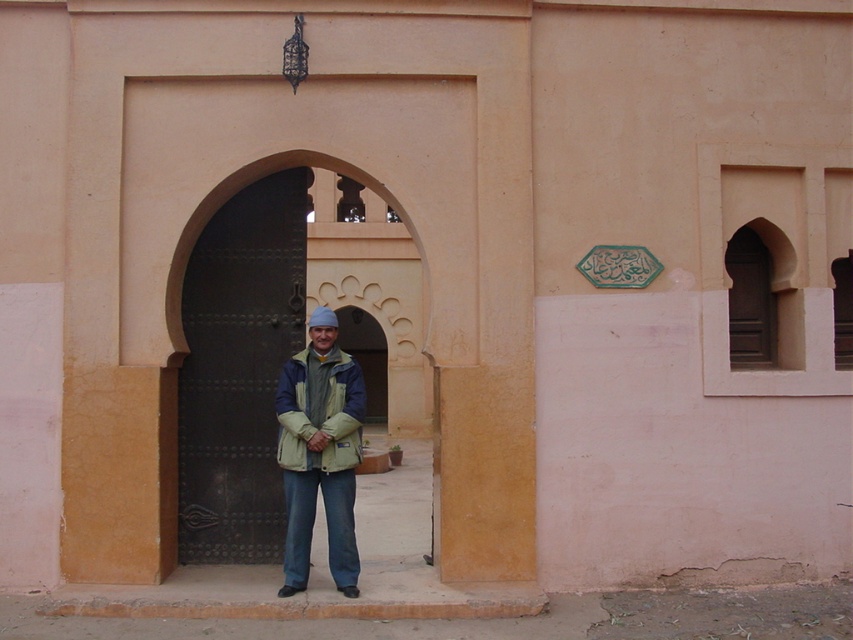
Does dark brown metal door at center appear under light green fabric jacket at center?

Actually, dark brown metal door at center is above light green fabric jacket at center.

Is dark brown metal door at center bigger than light green fabric jacket at center?

Correct, dark brown metal door at center is larger in size than light green fabric jacket at center.

What are the coordinates of `dark brown metal door at center` in the screenshot? It's located at (239, 371).

The height and width of the screenshot is (640, 853). In order to click on dark brown metal door at center in this screenshot , I will do `click(239, 371)`.

Measure the distance from dark brown metal door at center to beige textured jacket at center.

23.43 inches

Can you confirm if dark brown metal door at center is positioned to the right of beige textured jacket at center?

Incorrect, dark brown metal door at center is not on the right side of beige textured jacket at center.

You are a GUI agent. You are given a task and a screenshot of the screen. Output one action in this format:
    pyautogui.click(x=<x>, y=<y>)
    Task: Click on the dark brown metal door at center
    Image resolution: width=853 pixels, height=640 pixels.
    Given the screenshot: What is the action you would take?
    pyautogui.click(x=239, y=371)

At what (x,y) coordinates should I click in order to perform the action: click on dark brown metal door at center. Please return your answer as a coordinate pair (x, y). Looking at the image, I should click on (239, 371).

Is light green fabric jacket at center behind beige textured jacket at center?

No, it is not.

Is light green fabric jacket at center shorter than beige textured jacket at center?

No, light green fabric jacket at center is not shorter than beige textured jacket at center.

Is point (308, 321) positioned before point (296, 401)?

No.

Image resolution: width=853 pixels, height=640 pixels. Identify the location of light green fabric jacket at center. (318, 452).